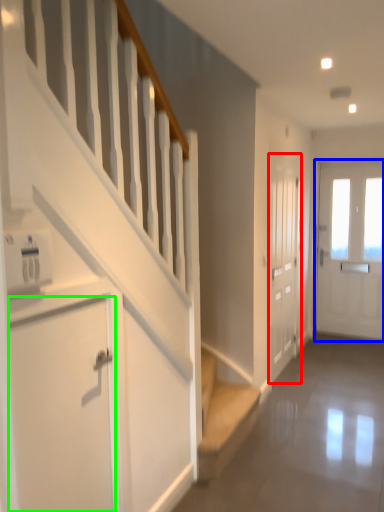
Question: Which is nearer to the door (highlighted by a red box)? door (highlighted by a blue box) or door (highlighted by a green box).

Choices:
 (A) door
 (B) door

Answer: (A)